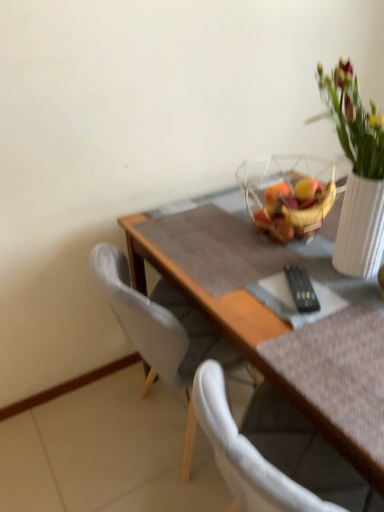
Identify the location of vacant area situated to the left side of transparent glass bowl at upper right. Image resolution: width=384 pixels, height=512 pixels. (213, 236).